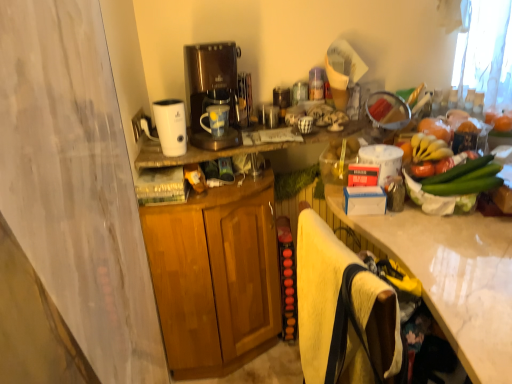
Question: Choose the correct answer: Is yellow fuzzy beach towel at lower right inside white marble countertop at right or outside it?

Choices:
 (A) inside
 (B) outside

Answer: (A)

Question: Looking at the image, does yellow fuzzy beach towel at lower right seem bigger or smaller compared to white marble countertop at right?

Choices:
 (A) big
 (B) small

Answer: (B)

Question: Estimate the real-world distances between objects in this image. Which object is farther from the yellow matte bananas at upper right?

Choices:
 (A) white glossy humidifier at upper center
 (B) white marble countertop at right
 (C) yellow fuzzy beach towel at lower right
 (D) wooden cabinet at center
 (E) matte white mug at center

Answer: (D)

Question: Based on their relative distances, which object is nearer to the white glossy humidifier at upper center?

Choices:
 (A) matte white mug at center
 (B) white marble countertop at right
 (C) yellow matte bananas at upper right
 (D) yellow fuzzy beach towel at lower right
 (E) wooden cabinet at center

Answer: (A)